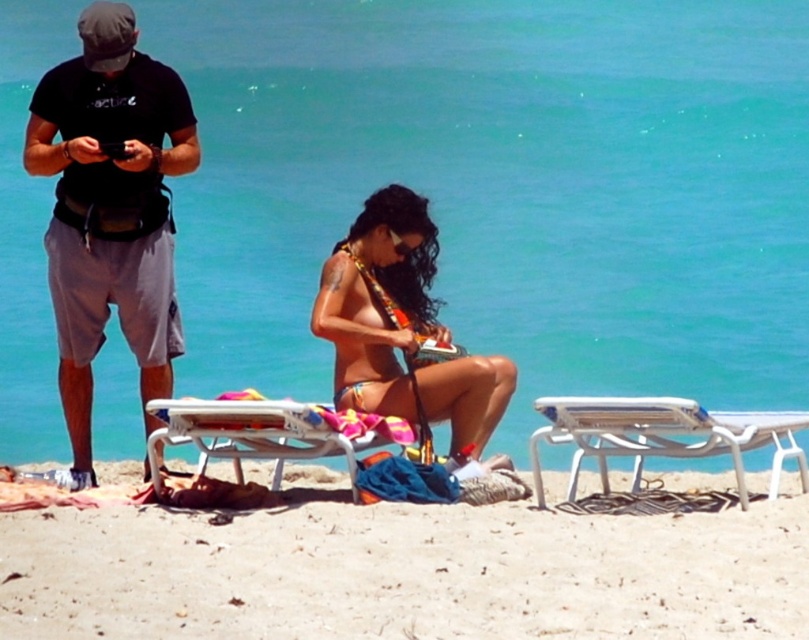
Does turquoise water at center have a larger size compared to white plastic chair at lower right?

Correct, turquoise water at center is larger in size than white plastic chair at lower right.

Is turquoise water at center to the left of white plastic chair at lower right from the viewer's perspective?

Correct, you'll find turquoise water at center to the left of white plastic chair at lower right.

The image size is (809, 640). I want to click on turquoise water at center, so click(x=503, y=188).

Does beige sand at lower center have a lesser width compared to white plastic chair at lower right?

Incorrect, beige sand at lower center's width is not less than white plastic chair at lower right's.

Who is more forward, (44, 566) or (621, 403)?

Positioned in front is point (44, 566).

Is point (297, 563) more distant than point (678, 419)?

That is False.

I want to click on beige sand at lower center, so click(x=405, y=570).

Can you confirm if turquoise water at center is bigger than white plastic beach chair at center?

Indeed, turquoise water at center has a larger size compared to white plastic beach chair at center.

Looking at this image, can you confirm if turquoise water at center is wider than white plastic beach chair at center?

Yes, turquoise water at center is wider than white plastic beach chair at center.

Which is behind, point (318, 104) or point (384, 417)?

Positioned behind is point (318, 104).

This screenshot has height=640, width=809. I want to click on turquoise water at center, so 503,188.